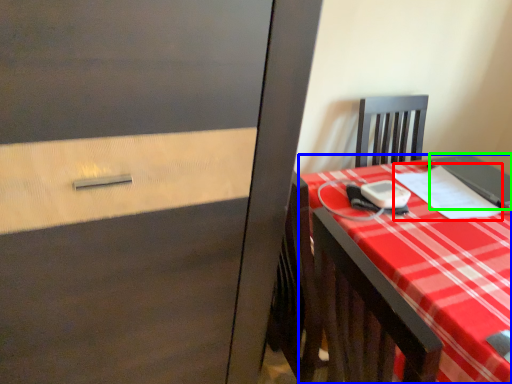
Question: Estimate the real-world distances between objects in this image. Which object is closer to notebook (highlighted by a red box), desk (highlighted by a blue box) or notebook (highlighted by a green box)?

Choices:
 (A) desk
 (B) notebook

Answer: (B)